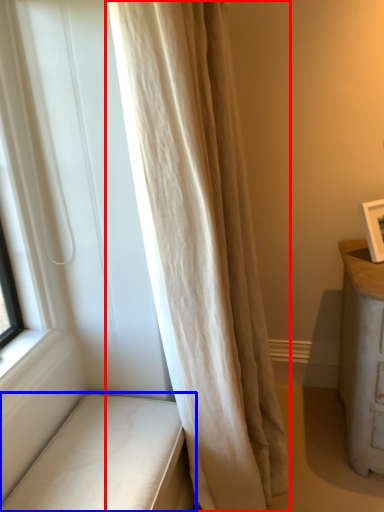
Question: Which object appears farthest to the camera in this image, curtain (highlighted by a red box) or furniture (highlighted by a blue box)?

Choices:
 (A) curtain
 (B) furniture

Answer: (B)